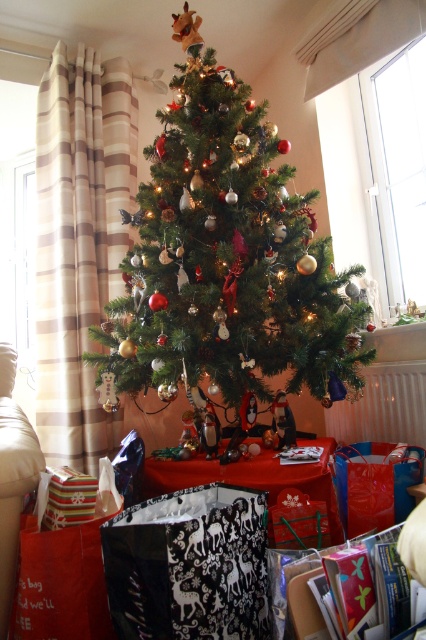
Question: Does green natural christmas tree at center appear under striped paper gift at lower left?

Choices:
 (A) yes
 (B) no

Answer: (B)

Question: Can you confirm if green natural christmas tree at center is bigger than striped paper gift at lower left?

Choices:
 (A) yes
 (B) no

Answer: (A)

Question: Can you confirm if green natural christmas tree at center is thinner than striped paper gift at lower left?

Choices:
 (A) no
 (B) yes

Answer: (A)

Question: Which point appears closest to the camera in this image?

Choices:
 (A) (129, 273)
 (B) (54, 472)

Answer: (B)

Question: Among these points, which one is farthest from the camera?

Choices:
 (A) (71, 493)
 (B) (150, 168)

Answer: (B)